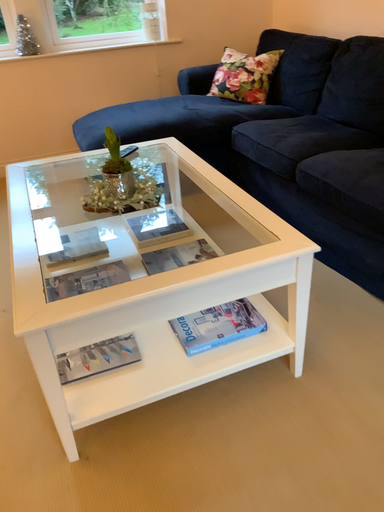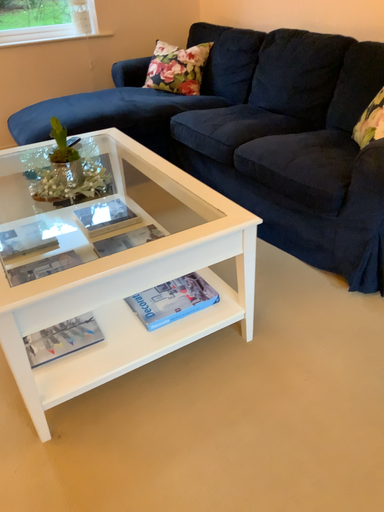
Question: Which way did the camera rotate in the video?

Choices:
 (A) rotated left
 (B) rotated right

Answer: (B)